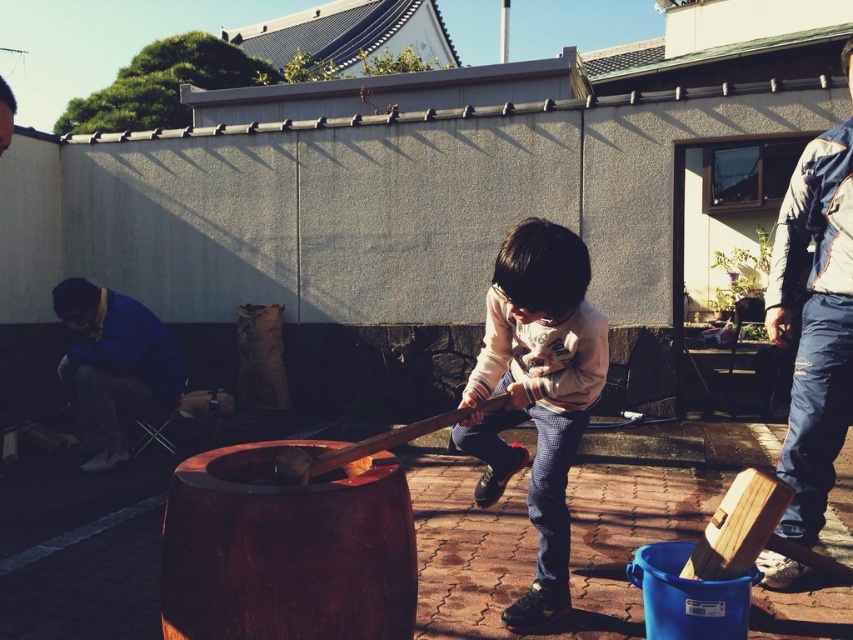
Measure the distance between point (532, 492) and camera.

3.28 meters

Is point (590, 380) positioned after point (813, 456)?

No, it is in front of (813, 456).

This screenshot has height=640, width=853. What are the coordinates of `white fleece sweater at center` in the screenshot? It's located at (537, 392).

Can you confirm if dark brown wooden barrel at center is bigger than blue fabric at left?

Actually, dark brown wooden barrel at center might be smaller than blue fabric at left.

Which is below, dark brown wooden barrel at center or blue fabric at left?

dark brown wooden barrel at center is below.

This screenshot has width=853, height=640. In order to click on dark brown wooden barrel at center in this screenshot , I will do `click(287, 548)`.

Who is shorter, dark brown wooden barrel at center or denim overalls at right?

dark brown wooden barrel at center is shorter.

Is dark brown wooden barrel at center behind denim overalls at right?

No, dark brown wooden barrel at center is closer to the viewer.

I want to click on dark brown wooden barrel at center, so click(x=287, y=548).

At what (x,y) coordinates should I click in order to perform the action: click on dark brown wooden barrel at center. Please return your answer as a coordinate pair (x, y). Looking at the image, I should click on (287, 548).